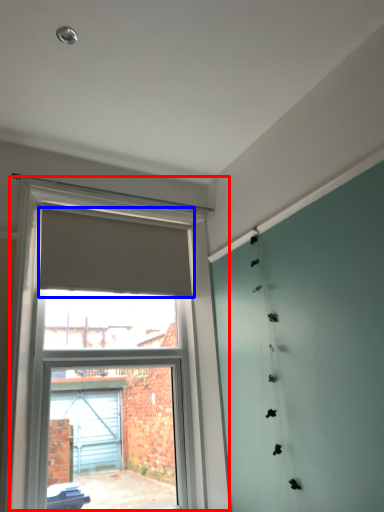
Question: Which point is closer to the camera, window (highlighted by a red box) or curtain (highlighted by a blue box)?

Choices:
 (A) window
 (B) curtain

Answer: (A)